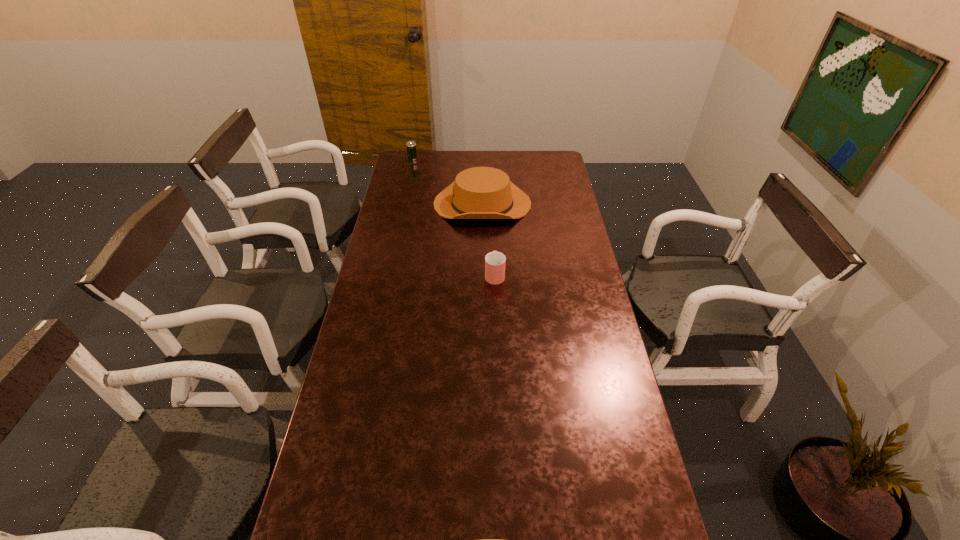
The width and height of the screenshot is (960, 540). I want to click on vacant space located on the side of the cup with the handle, so click(x=492, y=209).

This screenshot has height=540, width=960. I want to click on object that is positioned at the far edge, so click(411, 145).

In order to click on object situated at the left edge in this screenshot , I will do `click(411, 145)`.

Locate an element on the screen. The height and width of the screenshot is (540, 960). object that is positioned at the far left corner is located at coordinates (411, 145).

You are a GUI agent. You are given a task and a screenshot of the screen. Output one action in this format:
    pyautogui.click(x=<x>, y=<y>)
    Task: Click on the free space at the far edge of the desktop
    This screenshot has height=540, width=960.
    Given the screenshot: What is the action you would take?
    pyautogui.click(x=497, y=152)

You are a GUI agent. You are given a task and a screenshot of the screen. Output one action in this format:
    pyautogui.click(x=<x>, y=<y>)
    Task: Click on the vacant area at the left edge of the desktop
    This screenshot has height=540, width=960.
    Given the screenshot: What is the action you would take?
    pyautogui.click(x=419, y=195)

Find the location of a particular element. Image resolution: width=960 pixels, height=540 pixels. free region at the right edge of the desktop is located at coordinates (535, 177).

You are a GUI agent. You are given a task and a screenshot of the screen. Output one action in this format:
    pyautogui.click(x=<x>, y=<y>)
    Task: Click on the vacant space at the far left corner
    This screenshot has width=960, height=540.
    Given the screenshot: What is the action you would take?
    pyautogui.click(x=397, y=173)

You are a GUI agent. You are given a task and a screenshot of the screen. Output one action in this format:
    pyautogui.click(x=<x>, y=<y>)
    Task: Click on the vacant space that is in between the cowboy hat and the farthest object
    
    Given the screenshot: What is the action you would take?
    pyautogui.click(x=447, y=183)

You are a GUI agent. You are given a task and a screenshot of the screen. Output one action in this format:
    pyautogui.click(x=<x>, y=<y>)
    Task: Click on the empty space that is in between the farthest object and the cowboy hat
    
    Given the screenshot: What is the action you would take?
    pyautogui.click(x=447, y=183)